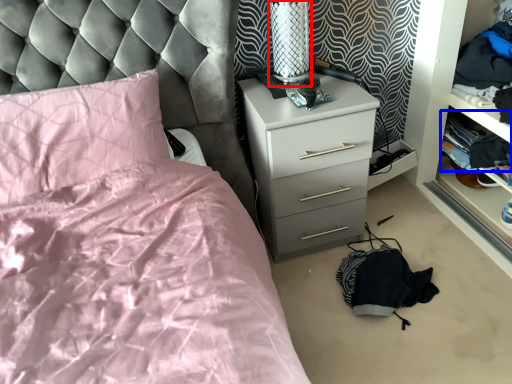
Question: Which object is closer to the camera taking this photo, table lamp (highlighted by a red box) or clothing (highlighted by a blue box)?

Choices:
 (A) table lamp
 (B) clothing

Answer: (A)